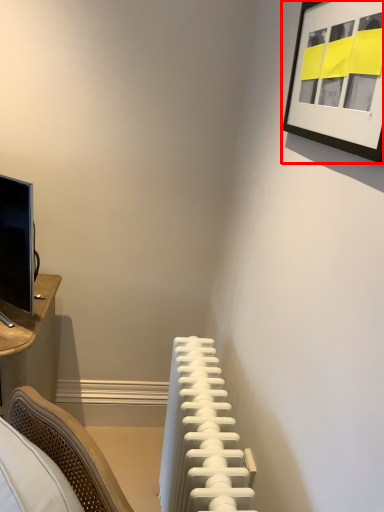
Question: In this image, where is picture frame (annotated by the red box) located relative to radiator?

Choices:
 (A) right
 (B) left

Answer: (A)